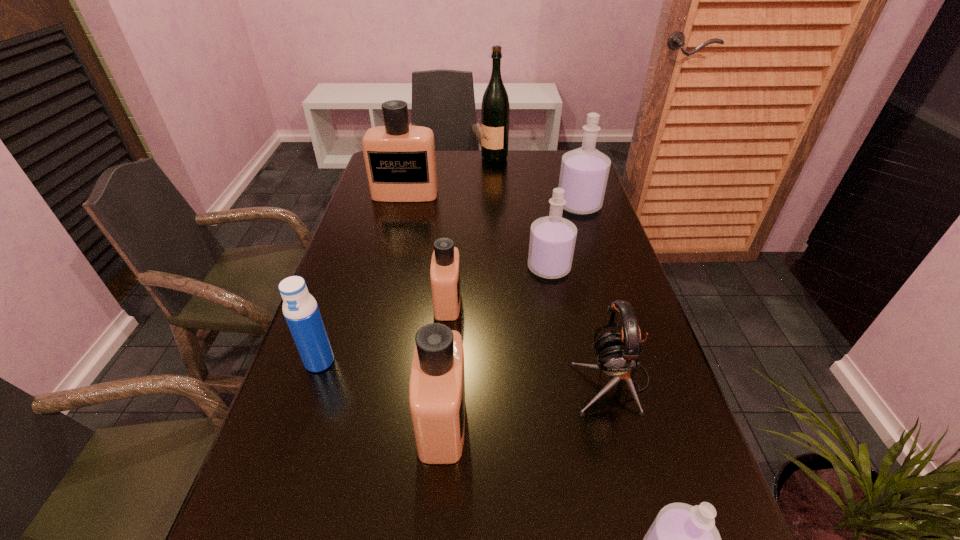
I want to click on the farthest object, so click(495, 110).

Where is `the tallest object`? This screenshot has width=960, height=540. the tallest object is located at coordinates (495, 110).

Identify the location of the leftmost beige perfume. (400, 159).

I want to click on the farthest beige perfume, so click(400, 159).

Where is `the biggest purple perfume`? the biggest purple perfume is located at coordinates (584, 172).

Where is `the second nearest purple perfume`? The width and height of the screenshot is (960, 540). the second nearest purple perfume is located at coordinates (552, 238).

Locate an element on the screen. The height and width of the screenshot is (540, 960). the third farthest perfume is located at coordinates (552, 238).

The image size is (960, 540). What are the coordinates of `the second nearest perfume` in the screenshot? It's located at (437, 381).

Where is `the second biggest beige perfume`? This screenshot has width=960, height=540. the second biggest beige perfume is located at coordinates (437, 381).

The image size is (960, 540). Find the location of `black earphone`. black earphone is located at coordinates (618, 353).